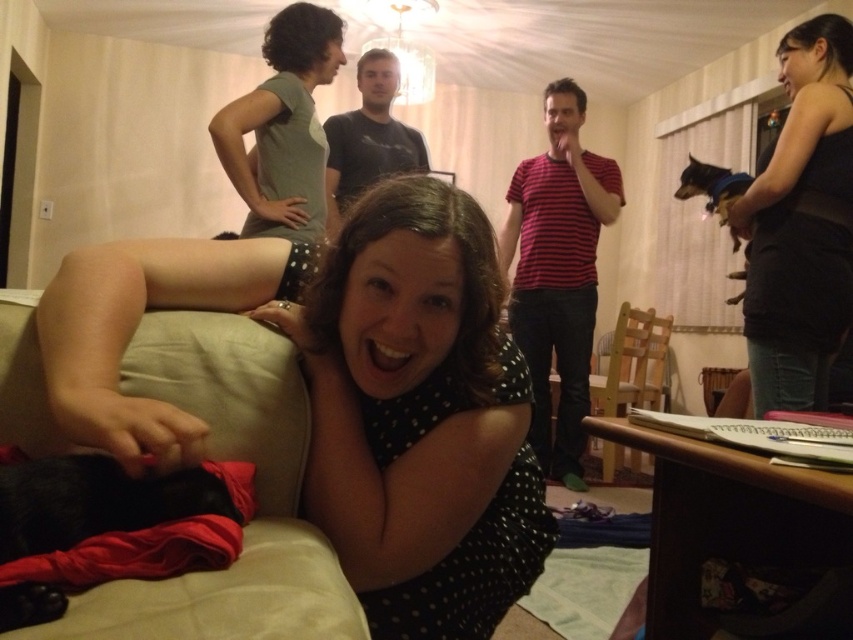
You are a photographer trying to capture a closeup of the black dotted dress at center and the beige fabric couch at lower left in the frame. Can you fit both objects into your camera viewfinder which has a maximum width of 10 inches?

The black dotted dress at center and beige fabric couch at lower left are 7.64 inches apart, so yes, both objects can fit into the camera viewfinder since the distance between them is within the 10 inch maximum width.